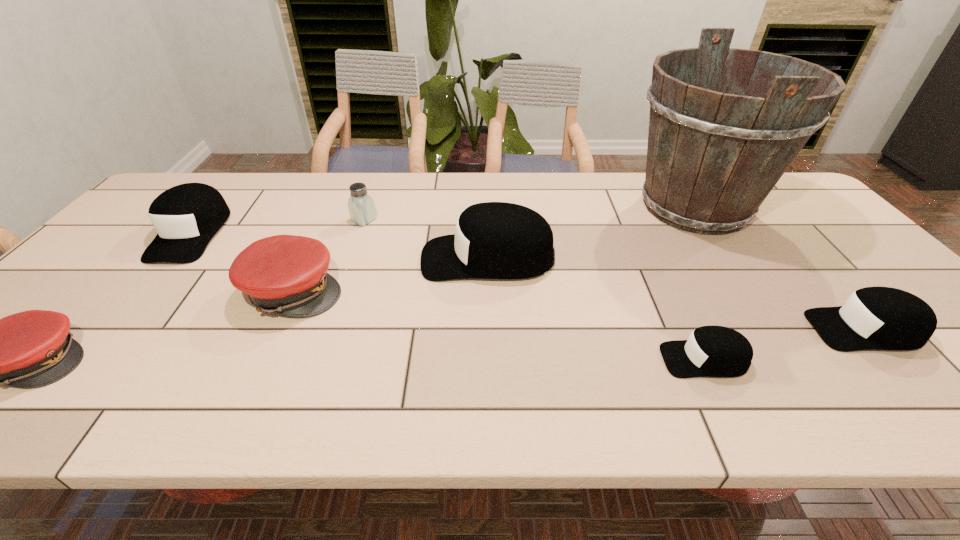
Where is `the second cap from right to left`? The height and width of the screenshot is (540, 960). the second cap from right to left is located at coordinates (711, 351).

Locate an element on the screen. This screenshot has width=960, height=540. free space located 0.120m on the left of the bucket is located at coordinates (587, 207).

I want to click on blank area located on the front-facing side of the second tallest object, so click(x=389, y=258).

The height and width of the screenshot is (540, 960). I want to click on free space located 0.150m on the front-facing side of the second tallest object, so pos(367,258).

Find the location of `free space located 0.330m on the front-facing side of the second tallest object`. free space located 0.330m on the front-facing side of the second tallest object is located at coordinates (300, 258).

Locate an element on the screen. The height and width of the screenshot is (540, 960). vacant point located on the front-facing side of the leftmost black cap is located at coordinates (107, 334).

Where is `vacant space located on the left of the saltshaker`? This screenshot has height=540, width=960. vacant space located on the left of the saltshaker is located at coordinates (273, 220).

At what (x,y) coordinates should I click in order to perform the action: click on vacant region located 0.340m on the front of the bigger red cap with an emblem. Please return your answer as a coordinate pair (x, y). The image size is (960, 540). Looking at the image, I should click on (479, 291).

The width and height of the screenshot is (960, 540). I want to click on blank area located 0.070m on the front-facing side of the rightmost black cap, so click(780, 329).

This screenshot has width=960, height=540. I want to click on vacant space located on the front-facing side of the rightmost black cap, so click(746, 329).